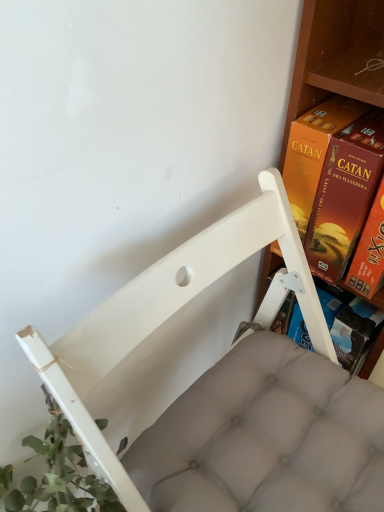
Question: Is point (332, 132) positioned closer to the camera than point (72, 355)?

Choices:
 (A) farther
 (B) closer

Answer: (A)

Question: Considering the relative positions of orange cardboard game at right and white fabric chair at center in the image provided, is orange cardboard game at right to the left or to the right of white fabric chair at center?

Choices:
 (A) left
 (B) right

Answer: (B)

Question: Relative to white fabric chair at center, is orange cardboard game at right in front or behind?

Choices:
 (A) front
 (B) behind

Answer: (B)

Question: Based on their positions, is white fabric chair at center located to the left or right of orange cardboard game at right?

Choices:
 (A) right
 (B) left

Answer: (B)

Question: Based on their sizes in the image, would you say white fabric chair at center is bigger or smaller than orange cardboard game at right?

Choices:
 (A) big
 (B) small

Answer: (A)

Question: Is point (122, 330) closer or farther from the camera than point (349, 175)?

Choices:
 (A) closer
 (B) farther

Answer: (A)

Question: Considering the positions of white fabric chair at center and orange cardboard game at right in the image, is white fabric chair at center taller or shorter than orange cardboard game at right?

Choices:
 (A) short
 (B) tall

Answer: (B)